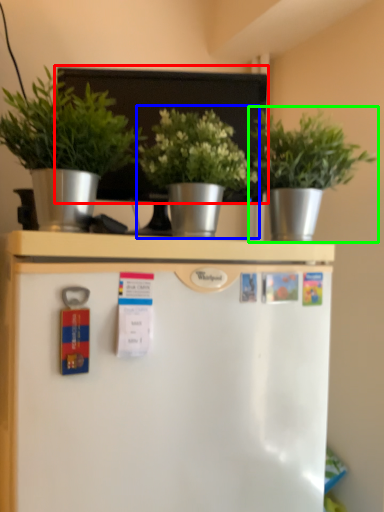
Question: Based on their relative distances, which object is nearer to bulletin board (highlighted by a red box)? Choose from houseplant (highlighted by a blue box) and houseplant (highlighted by a green box).

Choices:
 (A) houseplant
 (B) houseplant

Answer: (A)